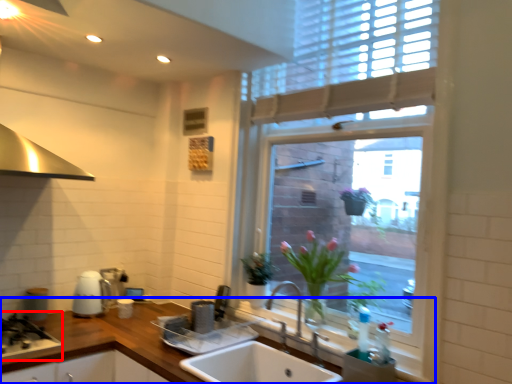
Question: Which of the following is the closest to the observer, gas stove (highlighted by a red box) or countertop (highlighted by a blue box)?

Choices:
 (A) gas stove
 (B) countertop

Answer: (B)